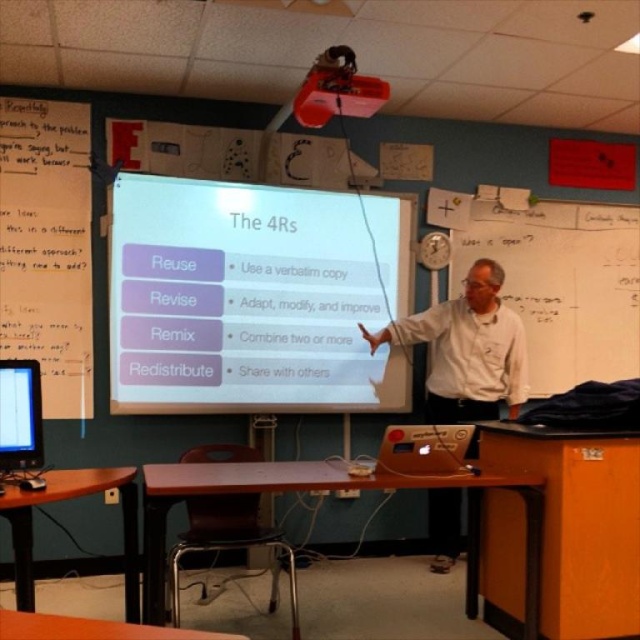
Question: Can you confirm if white glossy projector screen at center is positioned below black glossy screen at lower left?

Choices:
 (A) yes
 (B) no

Answer: (B)

Question: Is white shirt at center positioned before black glossy screen at lower left?

Choices:
 (A) no
 (B) yes

Answer: (A)

Question: Which point is farther from the camera taking this photo?

Choices:
 (A) (492, 326)
 (B) (593, 296)

Answer: (B)

Question: Estimate the real-world distances between objects in this image. Which object is closer to the black glossy screen at lower left?

Choices:
 (A) white shirt at center
 (B) white glossy projector screen at center
 (C) whiteboard at right

Answer: (B)

Question: Which object appears closest to the camera in this image?

Choices:
 (A) black glossy screen at lower left
 (B) whiteboard at right
 (C) white shirt at center

Answer: (A)

Question: Can you confirm if whiteboard at right is positioned to the left of white shirt at center?

Choices:
 (A) yes
 (B) no

Answer: (B)